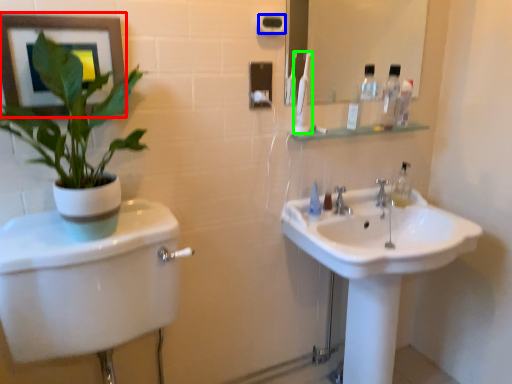
Question: Based on their relative distances, which object is nearer to picture frame (highlighted by a red box)? Choose from towel bar (highlighted by a blue box) and toothbrush (highlighted by a green box).

Choices:
 (A) towel bar
 (B) toothbrush

Answer: (A)